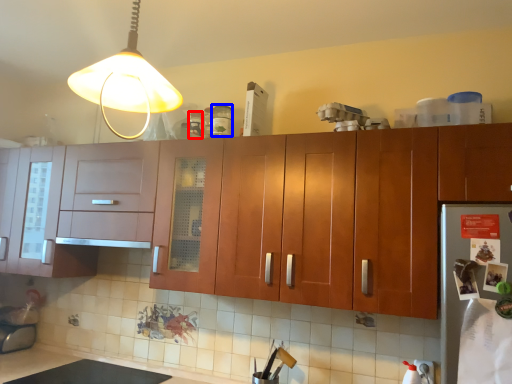
Question: Which of the following is the closest to the observer, bottle (highlighted by a red box) or bottle (highlighted by a blue box)?

Choices:
 (A) bottle
 (B) bottle

Answer: (B)